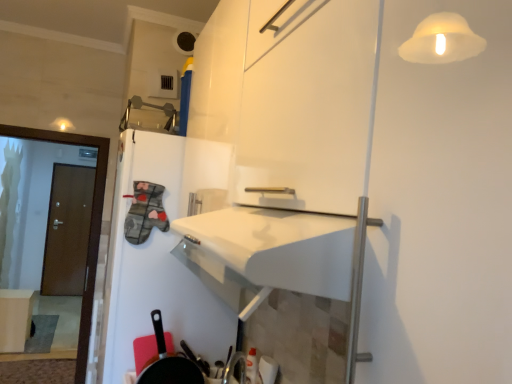
This screenshot has width=512, height=384. What are the coordinates of `blank space situated above brown wooden door at left (from a real-world perspective)` in the screenshot? It's located at 48,124.